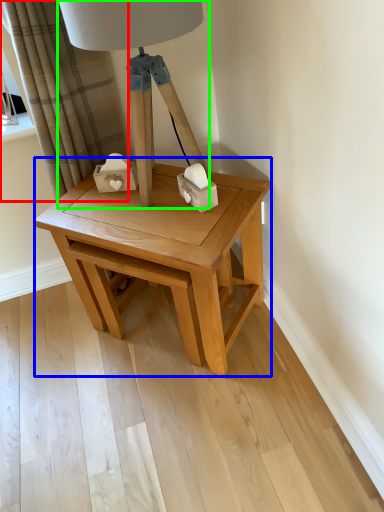
Question: Which object is positioned closest to curtain (highlighted by a red box)? Select from table (highlighted by a blue box) and table lamp (highlighted by a green box).

Choices:
 (A) table
 (B) table lamp

Answer: (B)